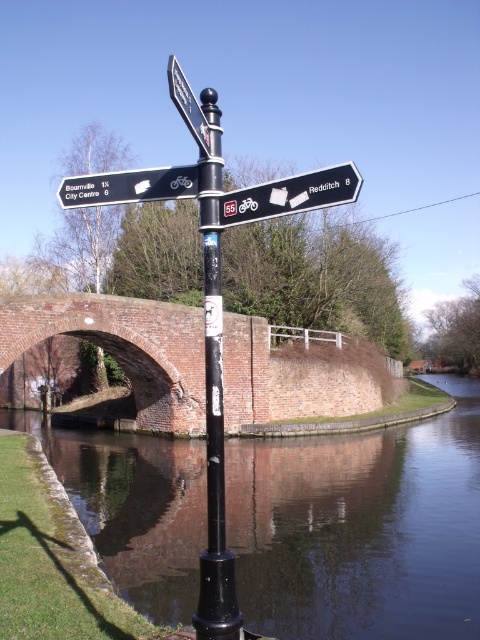
You are a cyclist planning your route and notice two signs in the scene. Which sign is wider, the white plastic sign at upper right or the metallic silver sign at upper center?

The metallic silver sign at upper center is wider than the white plastic sign at upper right.

You are standing at the point marked by the coordinates point [214,401]. Looking towards the black metal pole at center, which direction should you walk to reach the City Centre sign that points 6 miles away?

The black metal pole at center is located at point [214,401]. Since the pole has directional signs including the City Centre pointing 6 miles away, you should walk in the direction the City Centre sign is pointing from the pole to reach it.